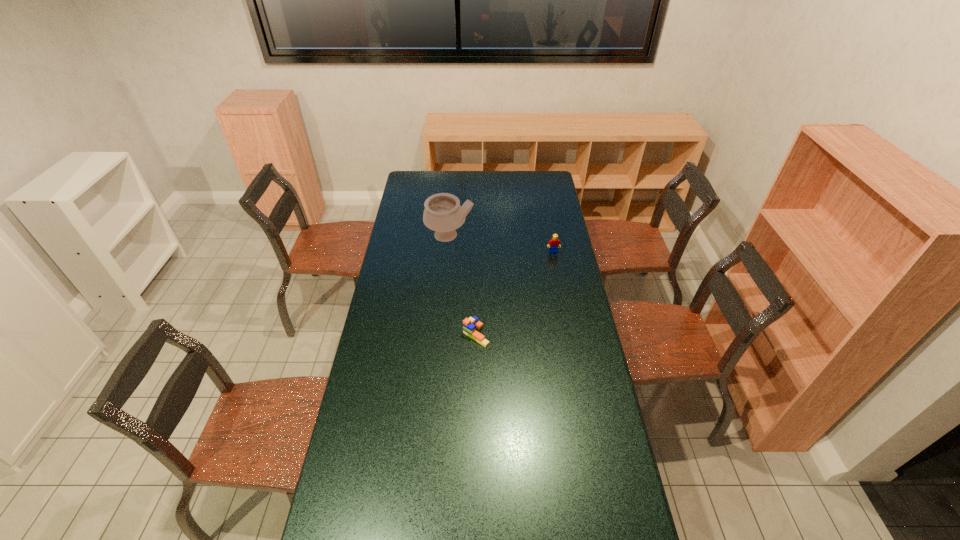
Identify the location of the second closest object relative to the second nearest object. Image resolution: width=960 pixels, height=540 pixels. (470, 325).

What are the coordinates of `object that is the closest to the pottery` in the screenshot? It's located at (553, 245).

This screenshot has height=540, width=960. I want to click on free point that satisfies the following two spatial constraints: 1. on the front side of the farthest object; 2. on the left side of the nearest object, so click(442, 335).